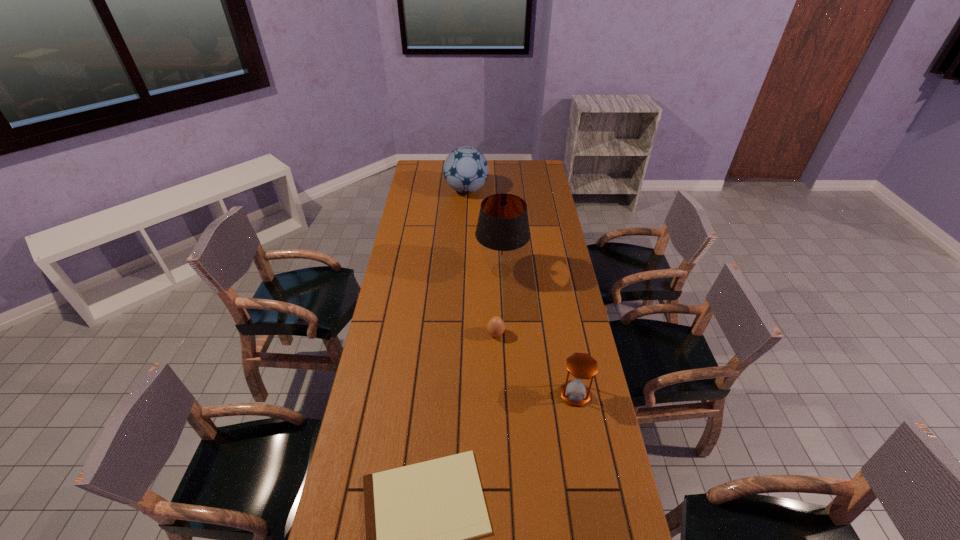
Locate an element on the screen. vacant area situated 0.390m on the back of the third shortest object is located at coordinates (558, 300).

The height and width of the screenshot is (540, 960). I want to click on vacant area situated 0.060m on the right of the third farthest object, so click(520, 334).

Image resolution: width=960 pixels, height=540 pixels. What are the coordinates of `object that is at the far edge` in the screenshot? It's located at (465, 169).

Where is `object that is at the right edge`? The width and height of the screenshot is (960, 540). object that is at the right edge is located at coordinates (582, 366).

Find the location of a particular element. vacant space at the far edge is located at coordinates (489, 178).

Where is `free space at the left edge of the desktop`? This screenshot has height=540, width=960. free space at the left edge of the desktop is located at coordinates (400, 267).

You are a GUI agent. You are given a task and a screenshot of the screen. Output one action in this format:
    pyautogui.click(x=<x>, y=<y>)
    Task: Click on the vacant space at the right edge of the desktop
    The height and width of the screenshot is (540, 960).
    Given the screenshot: What is the action you would take?
    pyautogui.click(x=555, y=348)

Locate an element on the screen. This screenshot has height=540, width=960. vacant area that lies between the soccer ball and the fourth tallest object is located at coordinates (481, 262).

This screenshot has height=540, width=960. Identify the location of free space between the tallest object and the hourglass. (539, 332).

Where is `free spot between the second shortest object and the soccer ball`? Image resolution: width=960 pixels, height=540 pixels. free spot between the second shortest object and the soccer ball is located at coordinates (481, 262).